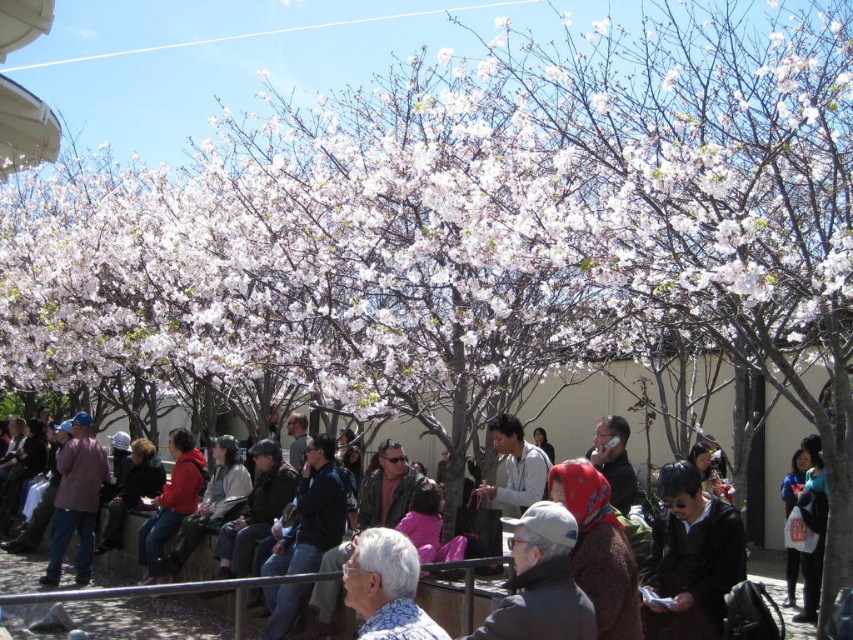
You are standing in the park and want to take a photo of both point (547, 506) and point (612, 480). Which point should you focus on first to ensure both are in focus?

You should focus on point (547, 506) first because it is closer to the camera than point (612, 480), ensuring both points are within the depth of field.